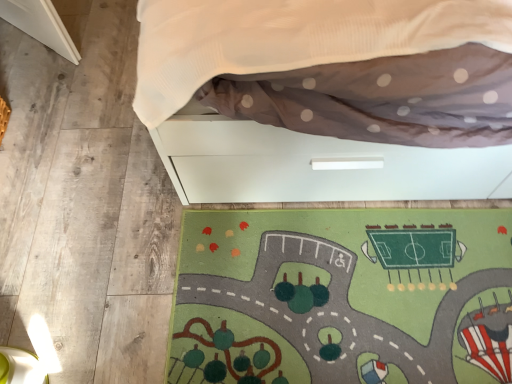
Where is `white glossy bed at center`? The image size is (512, 384). white glossy bed at center is located at coordinates (329, 97).

The width and height of the screenshot is (512, 384). What do you see at coordinates (329, 97) in the screenshot?
I see `white glossy bed at center` at bounding box center [329, 97].

The width and height of the screenshot is (512, 384). Identify the location of white glossy bed at center. [329, 97].